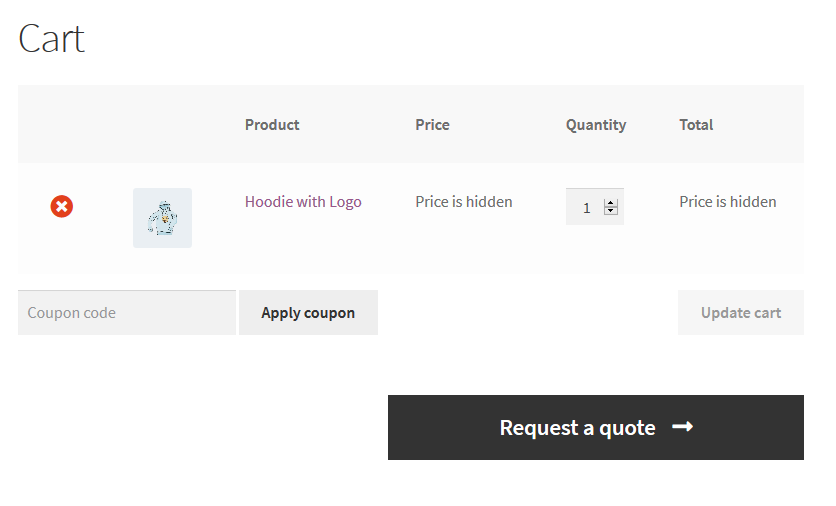
Image resolution: width=836 pixels, height=506 pixels. Identify the location of picture. (176, 234).